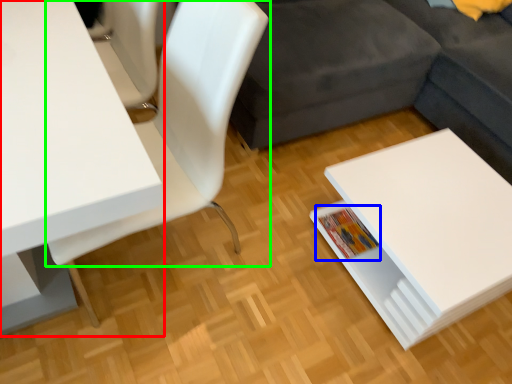
Question: Which object is positioned closest to table (highlighted by a red box)? Select from book (highlighted by a blue box) and chair (highlighted by a green box).

Choices:
 (A) book
 (B) chair

Answer: (B)